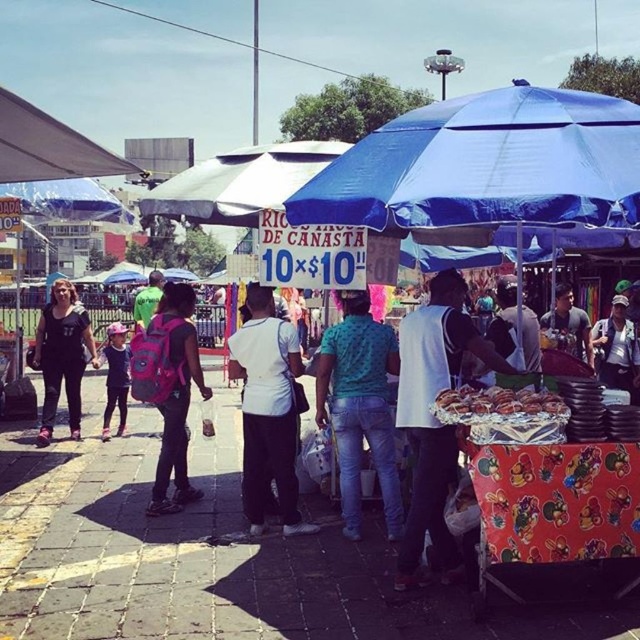
Question: Which of these objects is positioned farthest from the green matte shirt at center?

Choices:
 (A) printed fabric cart at center
 (B) pink fabric backpack at center
 (C) camouflage fabric cap at upper right
 (D) blue fabric umbrella at center

Answer: (C)

Question: Among these objects, which one is farthest from the camera?

Choices:
 (A) matte gray canopy at upper left
 (B) golden brown bread rolls at center
 (C) white matte shirt at center
 (D) pink fabric backpack at center

Answer: (D)

Question: Is pink fabric backpack at center positioned at the back of pink backpack at left?

Choices:
 (A) no
 (B) yes

Answer: (A)

Question: Is matte gray canopy at upper left below golden brown bread rolls at center?

Choices:
 (A) yes
 (B) no

Answer: (B)

Question: Is pink fabric backpack at center below camouflage fabric cap at upper right?

Choices:
 (A) yes
 (B) no

Answer: (A)

Question: Which object is closer to the camera taking this photo?

Choices:
 (A) pink fabric backpack at center
 (B) camouflage fabric cap at upper right
 (C) green matte shirt at center

Answer: (C)